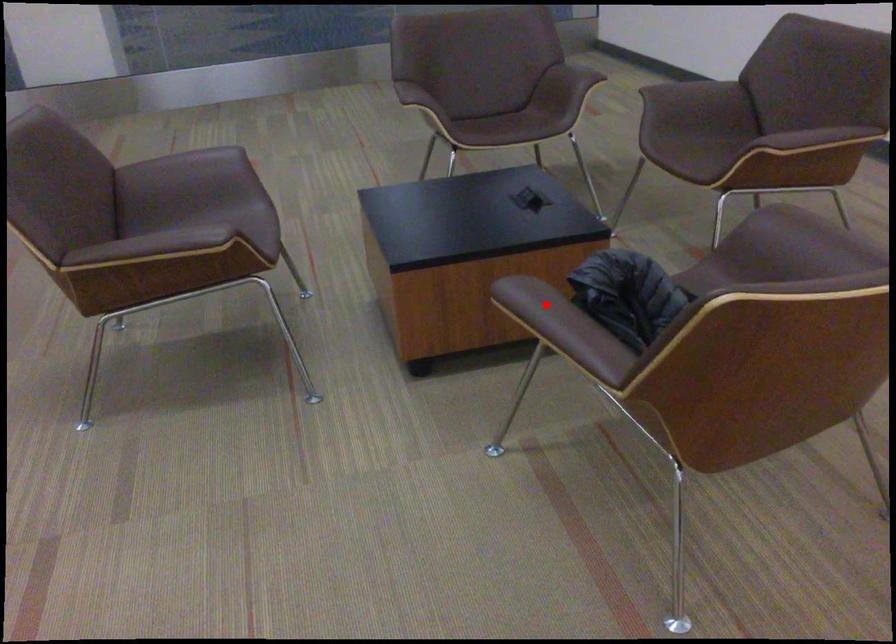
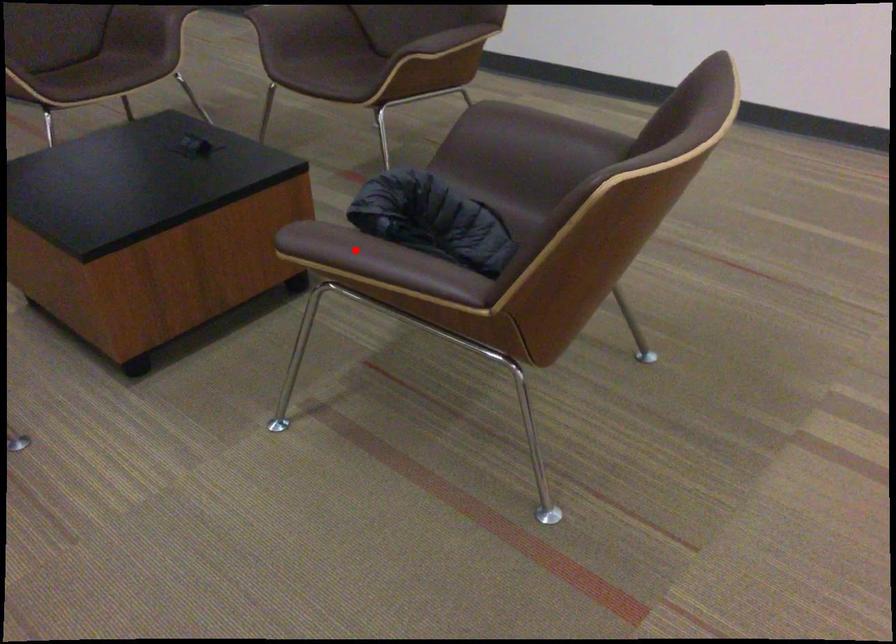
I am providing you with two images of the same scene from different viewpoints. A red point is marked on the first image and another point is marked on the second image. Is the marked point in image1 the same physical position as the marked point in image2?

Yes